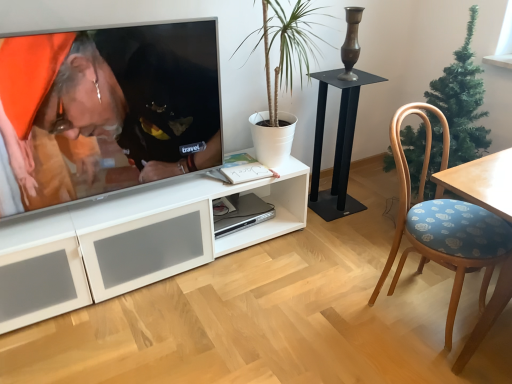
You are a GUI agent. You are given a task and a screenshot of the screen. Output one action in this format:
    pyautogui.click(x=<x>, y=<y>)
    Task: Click on the free space in front of black metal table at center
    This screenshot has height=384, width=512.
    Given the screenshot: What is the action you would take?
    pyautogui.click(x=342, y=228)